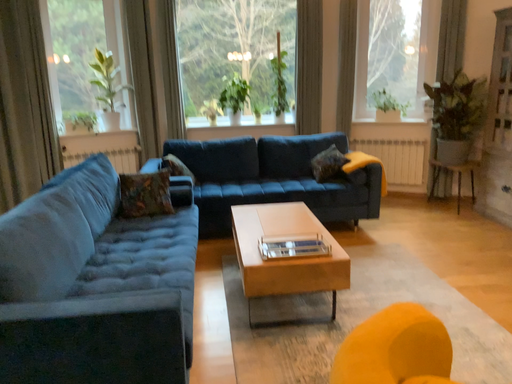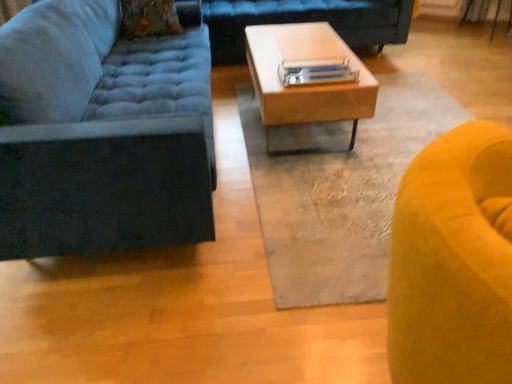
Question: How did the camera likely rotate when shooting the video?

Choices:
 (A) rotated upward
 (B) rotated downward

Answer: (B)